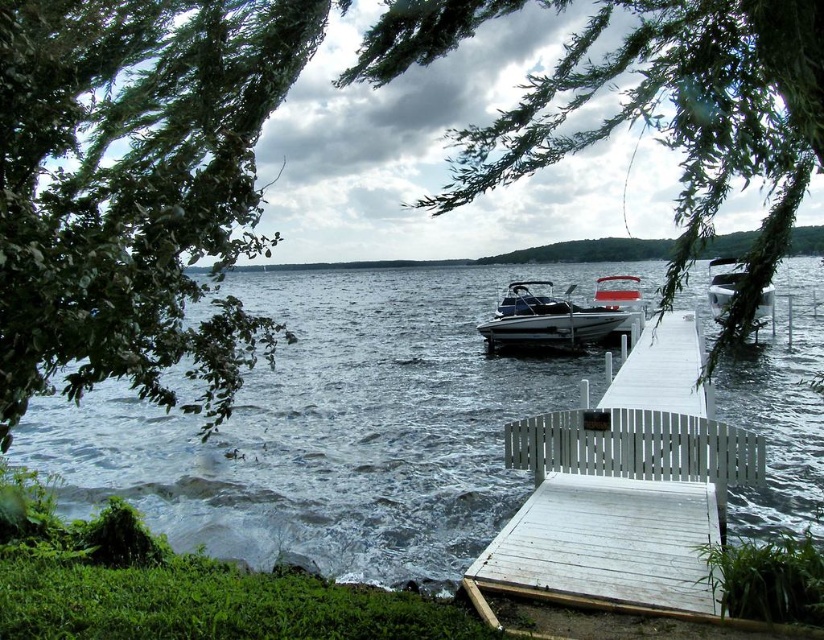
Does point (20, 381) come behind point (504, 556)?

No, it is not.

Is point (76, 300) positioned in front of point (612, 550)?

Yes.

Which is behind, point (158, 204) or point (626, 472)?

The point (626, 472) is behind.

Find the location of a particular element. This screenshot has width=824, height=640. green leafy branches at upper left is located at coordinates (134, 186).

Between green leafy tree at center and metallic blue boat at center, which one has less height?

With less height is metallic blue boat at center.

Can you confirm if green leafy tree at center is positioned to the left of metallic blue boat at center?

Indeed, green leafy tree at center is positioned on the left side of metallic blue boat at center.

Is point (722, 64) closer to viewer compared to point (605, 308)?

Yes, point (722, 64) is in front of point (605, 308).

At what (x,y) coordinates should I click in order to perform the action: click on green leafy tree at center. Please return your answer as a coordinate pair (x, y). Looking at the image, I should click on (680, 122).

Can you confirm if green leafy tree at center is positioned to the right of white wooden dock at center?

In fact, green leafy tree at center is to the left of white wooden dock at center.

Does green leafy tree at center appear under white wooden dock at center?

No, green leafy tree at center is not below white wooden dock at center.

Between point (755, 84) and point (548, 432), which one is positioned behind?

Point (548, 432)

The width and height of the screenshot is (824, 640). I want to click on green leafy tree at center, so click(680, 122).